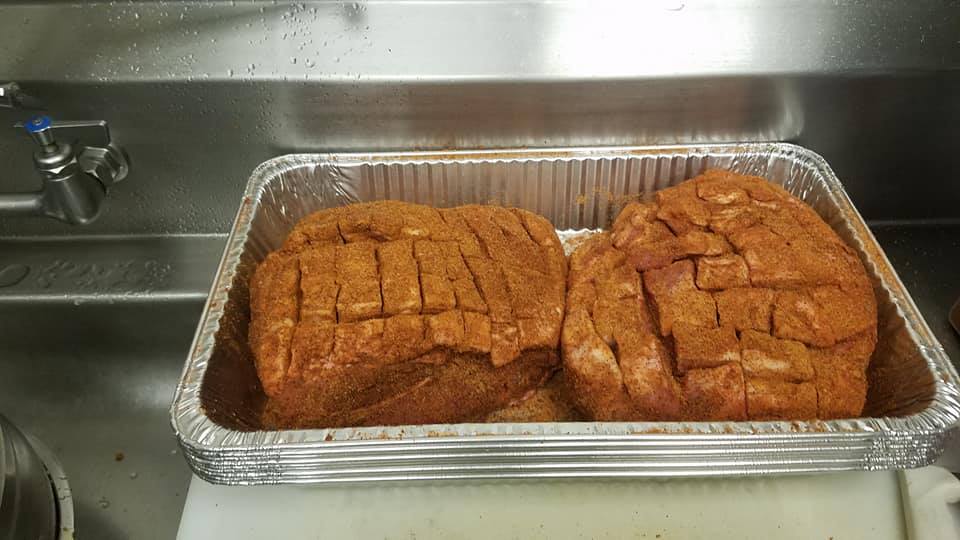
Where is `faucet tap`? The image size is (960, 540). faucet tap is located at coordinates (82, 133).